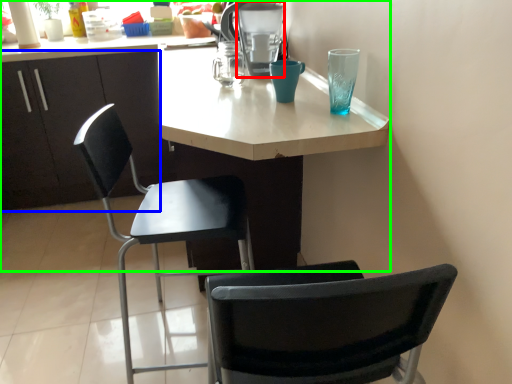
Question: Which object is the closest to the appliance (highlighted by a red box)? Choose among these: cabinetry (highlighted by a blue box) or desk (highlighted by a green box).

Choices:
 (A) cabinetry
 (B) desk

Answer: (B)